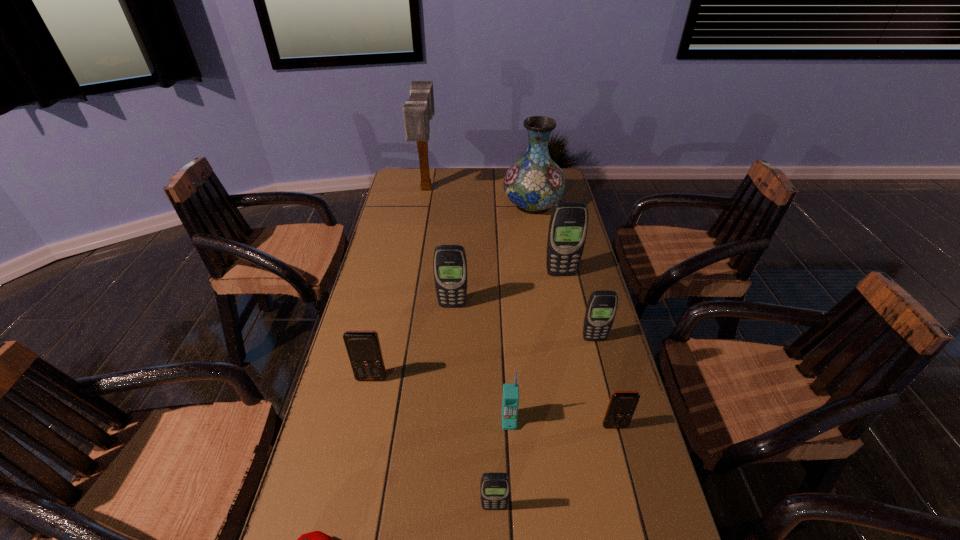
Where is `wood mallet`? Image resolution: width=960 pixels, height=540 pixels. wood mallet is located at coordinates (419, 109).

You are a GUI agent. You are given a task and a screenshot of the screen. Output one action in this format:
    pyautogui.click(x=<x>, y=<y>)
    Task: Click on the vase
    The height and width of the screenshot is (540, 960).
    Given the screenshot: What is the action you would take?
    pyautogui.click(x=534, y=183)

Where is `the second tallest object`? the second tallest object is located at coordinates (534, 183).

Where is `the eighth nearest object`? the eighth nearest object is located at coordinates (568, 225).

Where is `the tallest cellular telephone`? This screenshot has height=540, width=960. the tallest cellular telephone is located at coordinates (568, 225).

Where is `the leftmost gray cellular telephone`? Image resolution: width=960 pixels, height=540 pixels. the leftmost gray cellular telephone is located at coordinates (449, 263).

Where is `the sixth shortest cellular telephone`? Image resolution: width=960 pixels, height=540 pixels. the sixth shortest cellular telephone is located at coordinates (449, 263).

Where is `the second nearest gray cellular telephone`? the second nearest gray cellular telephone is located at coordinates (601, 308).

Identify the location of the second smallest gray cellular telephone. (601, 308).

The width and height of the screenshot is (960, 540). I want to click on the bigger orange cellular telephone, so click(364, 351).